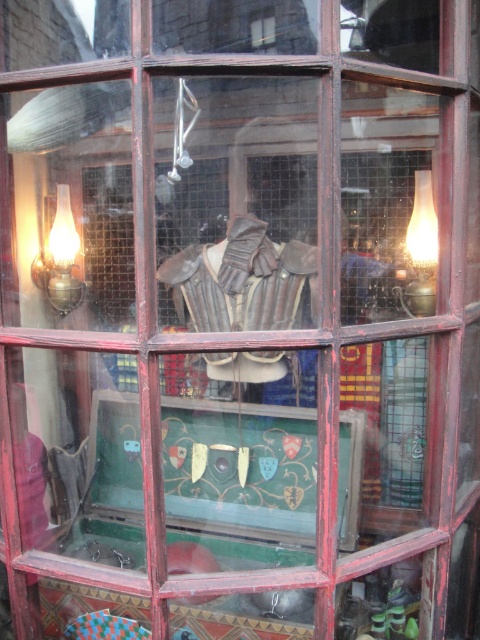
You are standing in front of the medieval display window and notice two lamps. The matte brass lamp at left and the matte glass lamp at right. Which one is taller?

The matte glass lamp at right is taller than the matte brass lamp at left.

You are standing in front of the medieval display window and notice a matte brass lamp at left. Where exactly is the matte brass lamp positioned within the window?

The matte brass lamp at left is located at point coordinates of 0.405 on the x axis and 0.125 on the y axis.